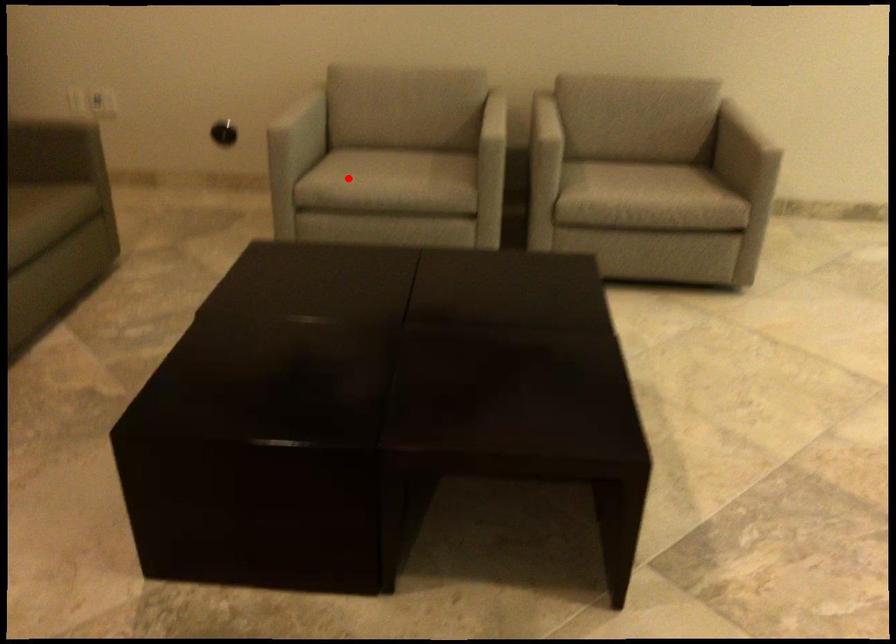
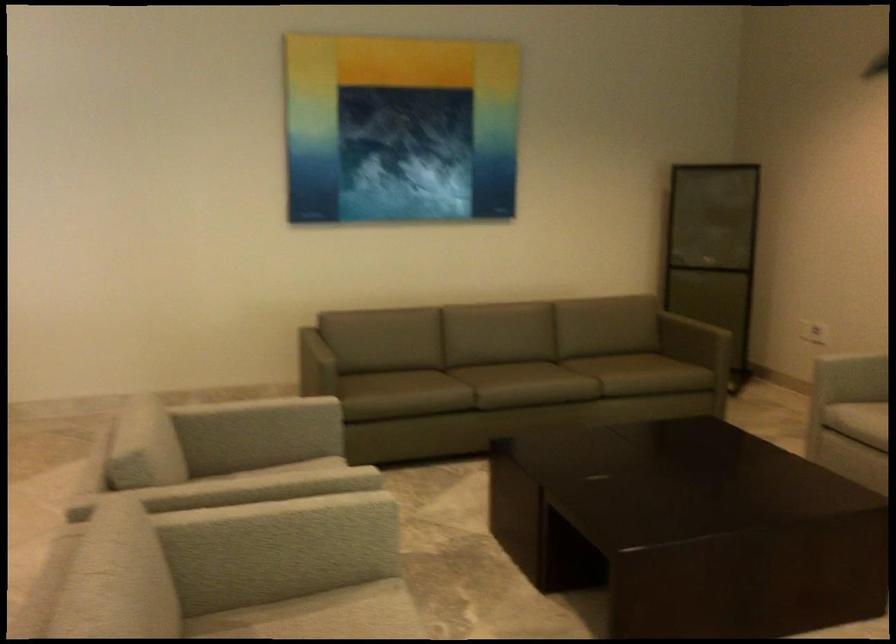
Question: A red point is marked in image1. In image2, is the corresponding 3D point closer to the camera or farther? Reply with the corresponding letter.

Choices:
 (A) The corresponding 3D point is closer.
 (B) The corresponding 3D point is farther.

Answer: (B)